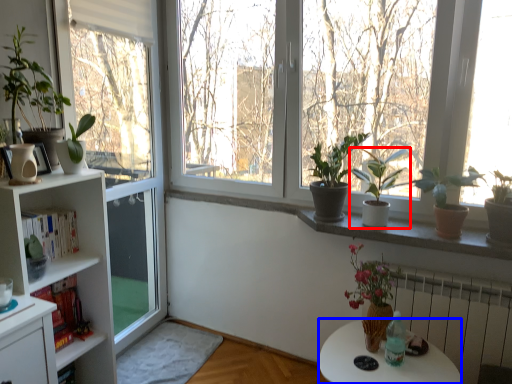
Question: Which point is further to the camera, houseplant (highlighted by a red box) or desk (highlighted by a blue box)?

Choices:
 (A) houseplant
 (B) desk

Answer: (A)